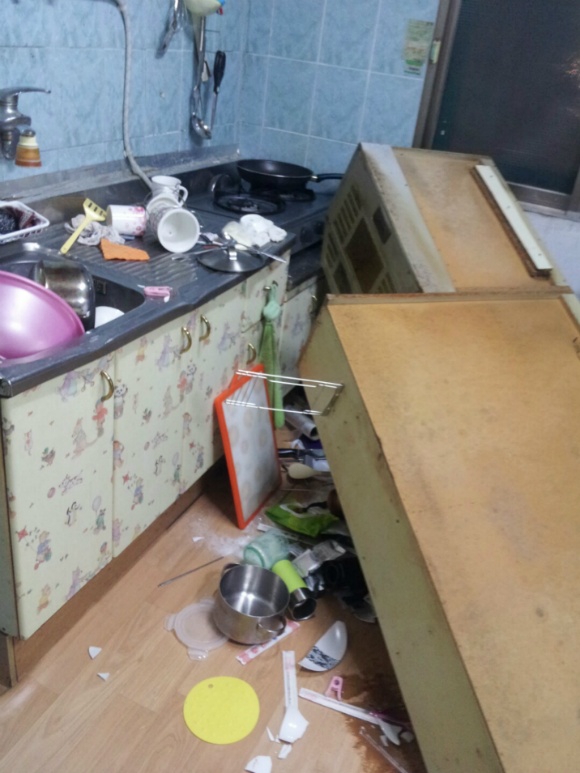
I want to click on dish towel, so click(x=271, y=335), click(x=94, y=232).